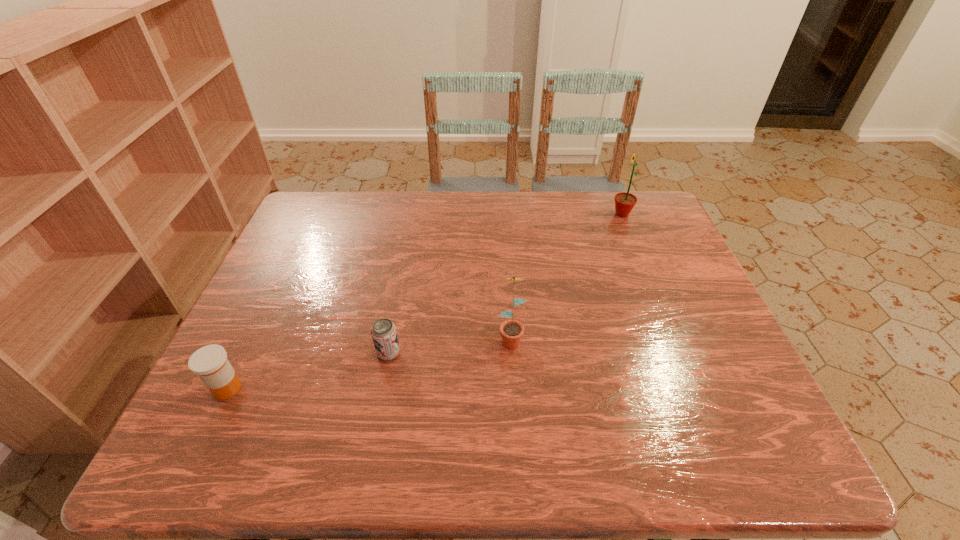
Find the location of a particular element. Image resolution: width=960 pixels, height=540 pixels. the taller sunflower is located at coordinates (624, 202).

The image size is (960, 540). What are the coordinates of `the rightmost object` in the screenshot? It's located at (624, 202).

Identify the location of the left sunflower. Image resolution: width=960 pixels, height=540 pixels. (511, 331).

Image resolution: width=960 pixels, height=540 pixels. Find the location of `the shorter sunflower`. the shorter sunflower is located at coordinates (511, 331).

Find the location of a particular element. the leftmost object is located at coordinates (210, 363).

Locate an element on the screen. medicine is located at coordinates (210, 363).

This screenshot has width=960, height=540. What are the coordinates of `beer can` in the screenshot? It's located at (384, 335).

Identify the location of free space located on the face of the tallest object. Image resolution: width=960 pixels, height=540 pixels. (547, 214).

The height and width of the screenshot is (540, 960). In order to click on vacant space situated 0.180m on the face of the tallest object in this screenshot , I will do `click(554, 214)`.

Locate an element on the screen. Image resolution: width=960 pixels, height=540 pixels. blank space located on the face of the tallest object is located at coordinates (503, 214).